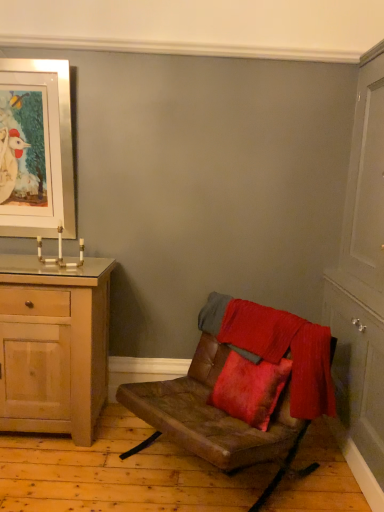
Question: From a real-world perspective, is silver metallic picture frame at upper left positioned under white wood cabinet at right based on gravity?

Choices:
 (A) no
 (B) yes

Answer: (A)

Question: From the image's perspective, is silver metallic picture frame at upper left under white wood cabinet at right?

Choices:
 (A) no
 (B) yes

Answer: (A)

Question: Can you confirm if silver metallic picture frame at upper left is bigger than white wood cabinet at right?

Choices:
 (A) no
 (B) yes

Answer: (A)

Question: Is the position of silver metallic picture frame at upper left less distant than that of white wood cabinet at right?

Choices:
 (A) no
 (B) yes

Answer: (A)

Question: From the image's perspective, is silver metallic picture frame at upper left on top of white wood cabinet at right?

Choices:
 (A) yes
 (B) no

Answer: (A)

Question: Is light wood cabinet at left taller or shorter than white wood cabinet at right?

Choices:
 (A) tall
 (B) short

Answer: (B)

Question: Is point (41, 322) closer or farther from the camera than point (374, 105)?

Choices:
 (A) closer
 (B) farther

Answer: (A)

Question: Considering their positions, is light wood cabinet at left located in front of or behind white wood cabinet at right?

Choices:
 (A) behind
 (B) front

Answer: (A)

Question: Considering the relative positions of light wood cabinet at left and white wood cabinet at right in the image provided, is light wood cabinet at left to the left or to the right of white wood cabinet at right?

Choices:
 (A) left
 (B) right

Answer: (A)

Question: Is light wood cabinet at left bigger or smaller than velvet red blanket at center?

Choices:
 (A) small
 (B) big

Answer: (B)

Question: From a real-world perspective, is light wood cabinet at left above or below velvet red blanket at center?

Choices:
 (A) below
 (B) above

Answer: (A)

Question: Does point (109, 266) appear closer or farther from the camera than point (228, 315)?

Choices:
 (A) farther
 (B) closer

Answer: (A)

Question: Considering the positions of light wood cabinet at left and velvet red blanket at center in the image, is light wood cabinet at left wider or thinner than velvet red blanket at center?

Choices:
 (A) thin
 (B) wide

Answer: (B)

Question: Is velvet red blanket at center in front of or behind leather cushion at center in the image?

Choices:
 (A) front
 (B) behind

Answer: (B)

Question: Considering the positions of velvet red blanket at center and leather cushion at center in the image, is velvet red blanket at center bigger or smaller than leather cushion at center?

Choices:
 (A) small
 (B) big

Answer: (A)